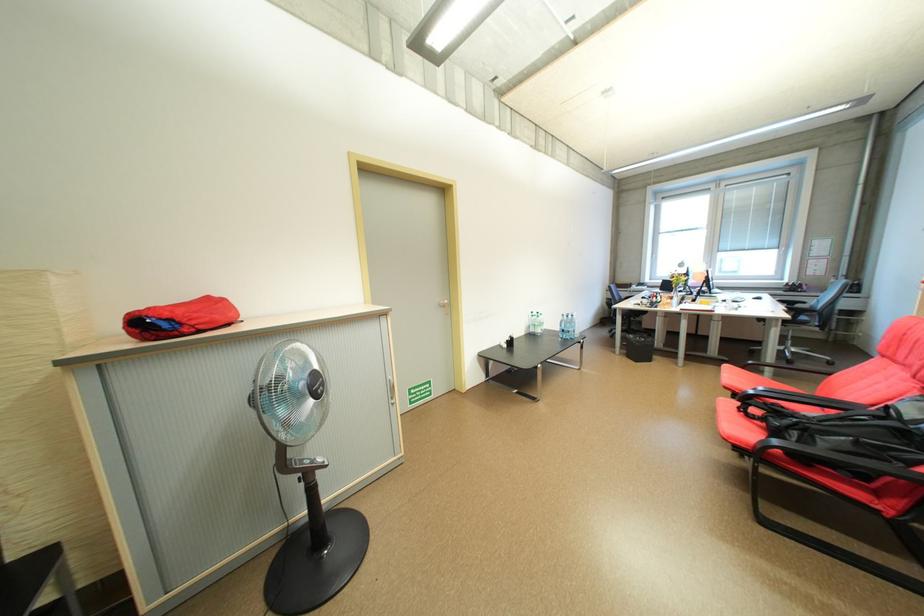
What do you see at coordinates (775, 389) in the screenshot? I see `the chair armrest` at bounding box center [775, 389].